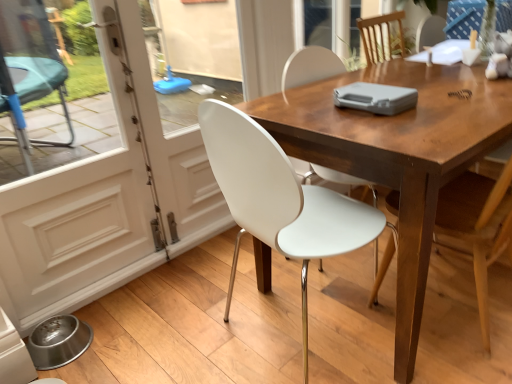
Where is `vacant region to the left of white plastic chair at center, marked as the second chair in a right-to-left arrangement`? This screenshot has height=384, width=512. vacant region to the left of white plastic chair at center, marked as the second chair in a right-to-left arrangement is located at coordinates (180, 323).